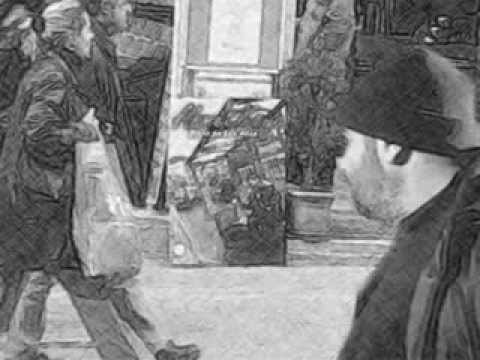
Where is `pot plant`? The height and width of the screenshot is (360, 480). pot plant is located at coordinates (318, 207).